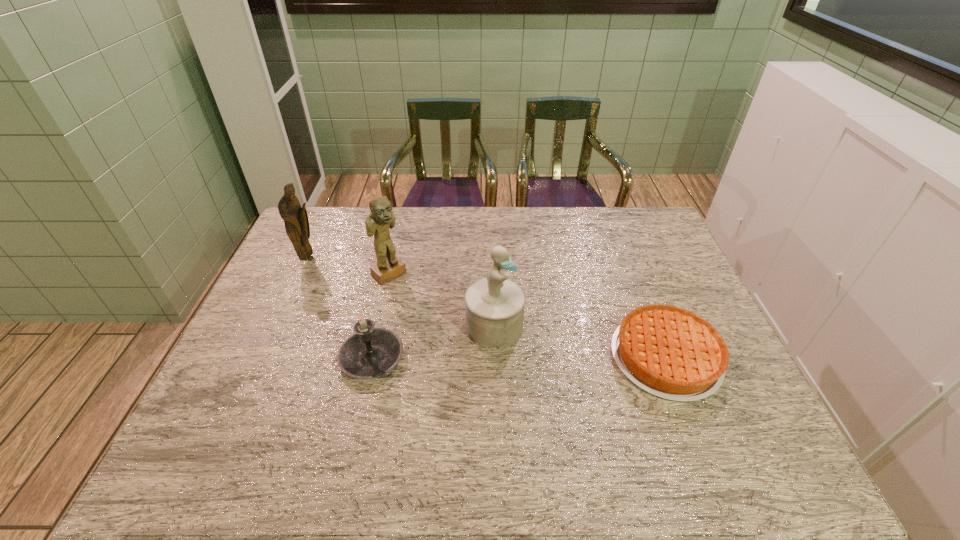
Identify the location of candle. Image resolution: width=960 pixels, height=540 pixels. (370, 352).

At what (x,y) coordinates should I click in order to perform the action: click on the rightmost object. Please return your answer as a coordinate pair (x, y). The image size is (960, 540). Looking at the image, I should click on (672, 353).

I want to click on the shortest object, so click(x=672, y=353).

What are the coordinates of `the leftmost object` in the screenshot? It's located at click(295, 217).

Locate an element on the screen. the second figurine from left to right is located at coordinates [x=381, y=218].

At what (x,y) coordinates should I click in order to perform the action: click on the rightmost figurine. Please return your answer as a coordinate pair (x, y). This screenshot has width=960, height=540. Looking at the image, I should click on (494, 305).

The width and height of the screenshot is (960, 540). What are the coordinates of `the nearest figurine` in the screenshot? It's located at (494, 305).

This screenshot has width=960, height=540. In order to click on vacant area situated 0.310m on the back of the second shortest object in this screenshot , I will do `click(394, 261)`.

I want to click on free space located on the left of the pie, so click(542, 357).

This screenshot has width=960, height=540. In order to click on vacant region located 0.370m on the front-facing side of the leftmost object in this screenshot , I will do `click(402, 309)`.